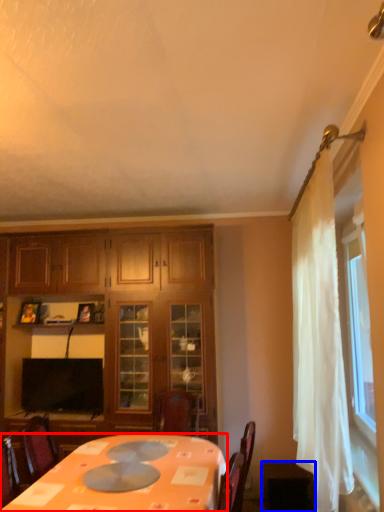
Question: Among these objects, which one is nearest to the camera, desk (highlighted by a red box) or table (highlighted by a blue box)?

Choices:
 (A) desk
 (B) table

Answer: (A)